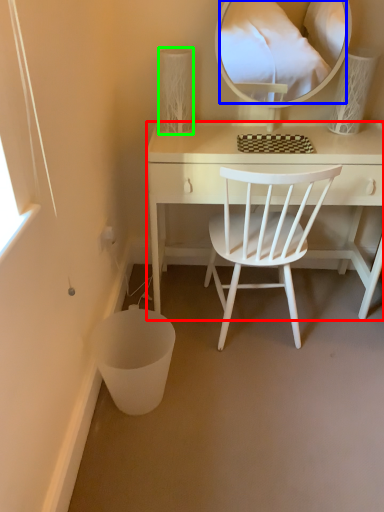
Question: Estimate the real-world distances between objects in this image. Which object is farther from desk (highlighted by a red box), mirror (highlighted by a blue box) or table lamp (highlighted by a green box)?

Choices:
 (A) mirror
 (B) table lamp

Answer: (A)